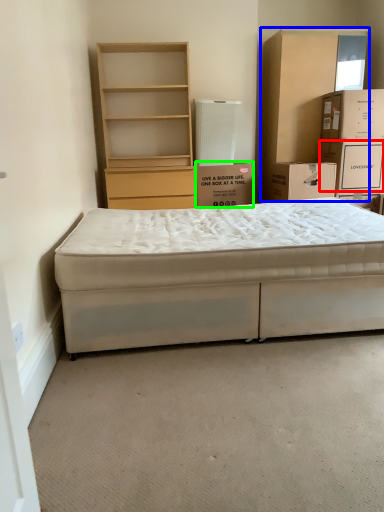
Question: Estimate the real-world distances between objects in this image. Which object is farther from storage box (highlighted by a red box), cabinetry (highlighted by a blue box) or box (highlighted by a green box)?

Choices:
 (A) cabinetry
 (B) box

Answer: (B)